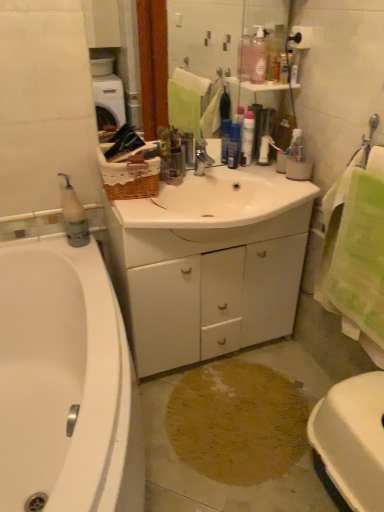
Question: Is white glossy bathtub at left at the right side of pink translucent bottle at upper center, arranged as the 2th cleaning product when viewed from the left?

Choices:
 (A) no
 (B) yes

Answer: (A)

Question: Is white glossy bathtub at left further to the viewer compared to pink translucent bottle at upper center, which ranks as the first cleaning product in top-to-bottom order?

Choices:
 (A) no
 (B) yes

Answer: (A)

Question: Does white glossy bathtub at left have a larger size compared to pink translucent bottle at upper center, which is the second cleaning product in bottom-to-top order?

Choices:
 (A) yes
 (B) no

Answer: (A)

Question: From the image's perspective, is white glossy bathtub at left under pink translucent bottle at upper center, arranged as the 2th cleaning product when viewed from the left?

Choices:
 (A) no
 (B) yes

Answer: (B)

Question: Is white glossy bathtub at left smaller than pink translucent bottle at upper center, which ranks as the first cleaning product in top-to-bottom order?

Choices:
 (A) no
 (B) yes

Answer: (A)

Question: From the image's perspective, is white glossy bathtub at left positioned above or below white matte cabinet at center?

Choices:
 (A) above
 (B) below

Answer: (B)

Question: Is white glossy bathtub at left bigger or smaller than white matte cabinet at center?

Choices:
 (A) big
 (B) small

Answer: (A)

Question: Considering the positions of white glossy bathtub at left and white matte cabinet at center in the image, is white glossy bathtub at left taller or shorter than white matte cabinet at center?

Choices:
 (A) tall
 (B) short

Answer: (B)

Question: Is white glossy bathtub at left wider or thinner than white matte cabinet at center?

Choices:
 (A) thin
 (B) wide

Answer: (B)

Question: Looking at the image, does white matte cabinet at center seem bigger or smaller compared to white glossy sink at center?

Choices:
 (A) big
 (B) small

Answer: (A)

Question: From the image's perspective, is white matte cabinet at center located above or below white glossy sink at center?

Choices:
 (A) below
 (B) above

Answer: (A)

Question: In the image, is white matte cabinet at center positioned in front of or behind white glossy sink at center?

Choices:
 (A) behind
 (B) front

Answer: (A)

Question: Is white matte cabinet at center wider or thinner than white glossy sink at center?

Choices:
 (A) wide
 (B) thin

Answer: (B)

Question: Considering the positions of white glossy toilet at lower right and white plastic bottle at left, arranged as the first cleaning product when viewed from the left, in the image, is white glossy toilet at lower right bigger or smaller than white plastic bottle at left, arranged as the first cleaning product when viewed from the left,?

Choices:
 (A) small
 (B) big

Answer: (B)

Question: In terms of height, does white glossy toilet at lower right look taller or shorter compared to white plastic bottle at left, which ranks as the 2th cleaning product in right-to-left order?

Choices:
 (A) short
 (B) tall

Answer: (B)